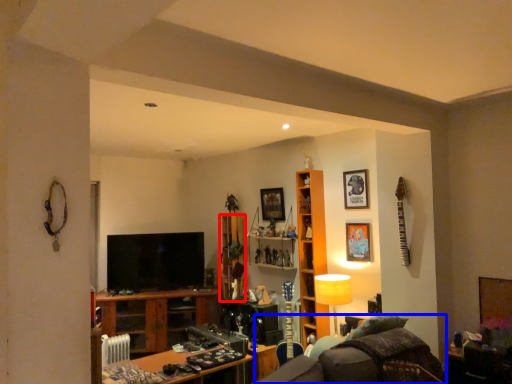
Question: Which object appears closest to the camera in this image, cabinet (highlighted by a red box) or swivel chair (highlighted by a blue box)?

Choices:
 (A) cabinet
 (B) swivel chair

Answer: (B)